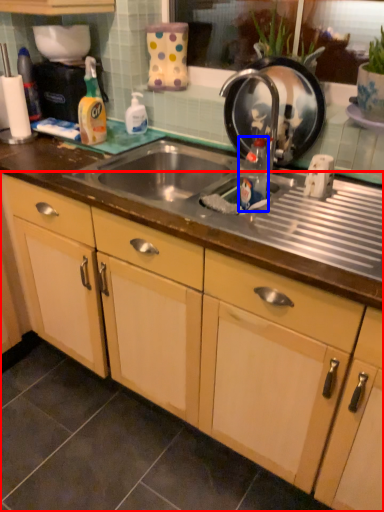
Question: Which of the following is the closest to the observer, cabinetry (highlighted by a red box) or bottle (highlighted by a blue box)?

Choices:
 (A) cabinetry
 (B) bottle

Answer: (A)